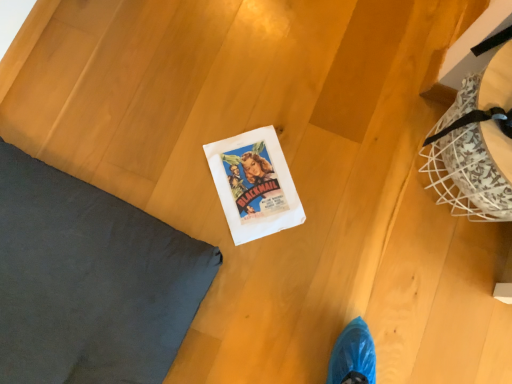
You are a GUI agent. You are given a task and a screenshot of the screen. Output one action in this format:
    pyautogui.click(x=<x>, y=<y>)
    Task: Click on the unoccupied area behind dark gray fabric pillow at upper left
    Image resolution: width=512 pixels, height=384 pixels.
    Given the screenshot: What is the action you would take?
    pyautogui.click(x=148, y=104)